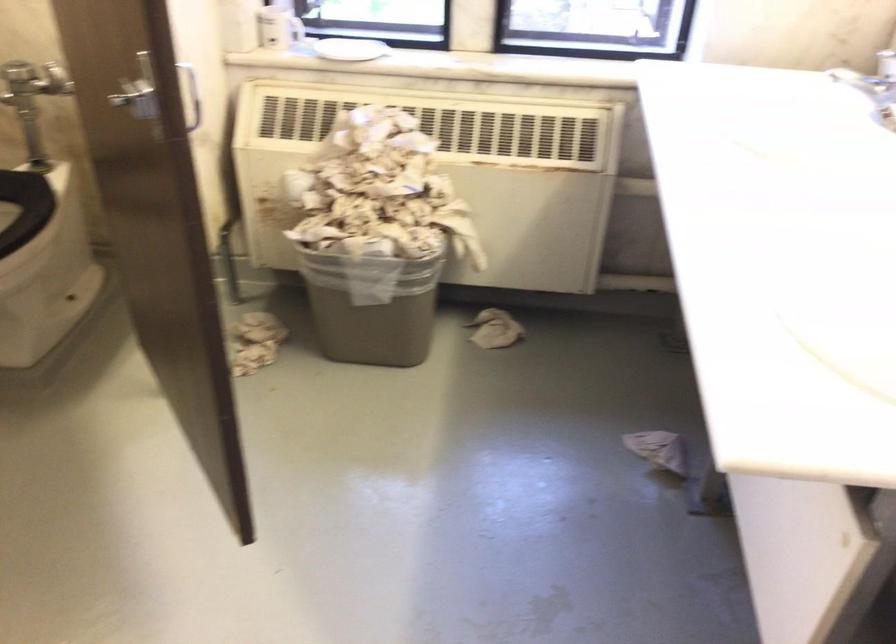
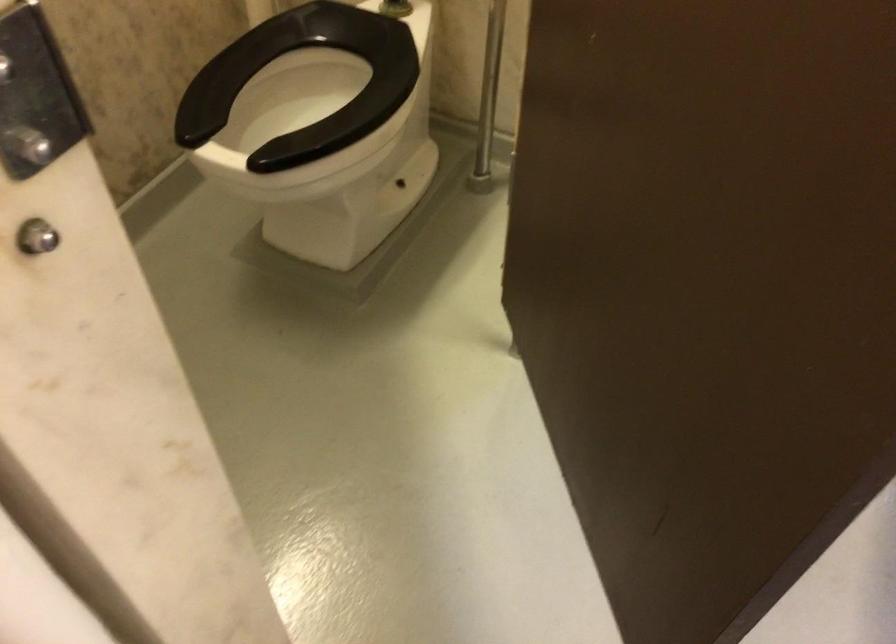
Question: How did the camera likely rotate?

Choices:
 (A) Left
 (B) Right
 (C) Up
 (D) Down

Answer: (A)